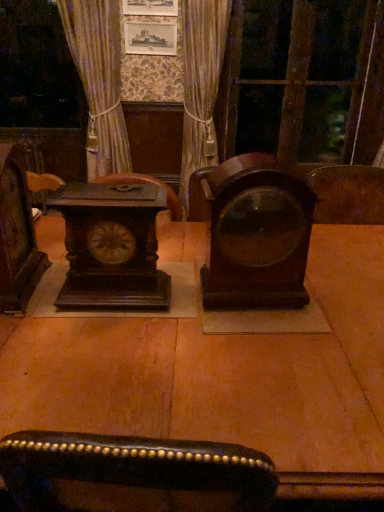
I want to click on free area in between mahogany wood alarm clock at center, the 2th alarm clock positioned from the left, and dark brown wood clock at left, positioned as the 1th alarm clock in left-to-right order, so pos(186,295).